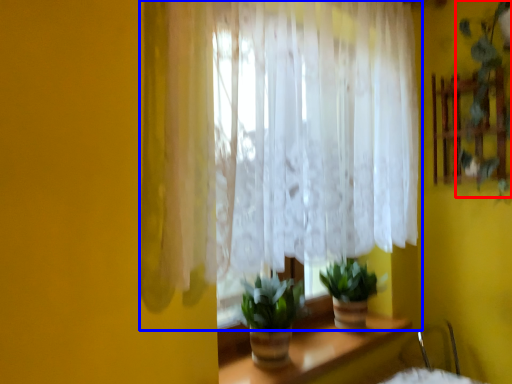
Question: Which object appears closest to the camera in this image, plant (highlighted by a red box) or curtain (highlighted by a blue box)?

Choices:
 (A) plant
 (B) curtain

Answer: (B)